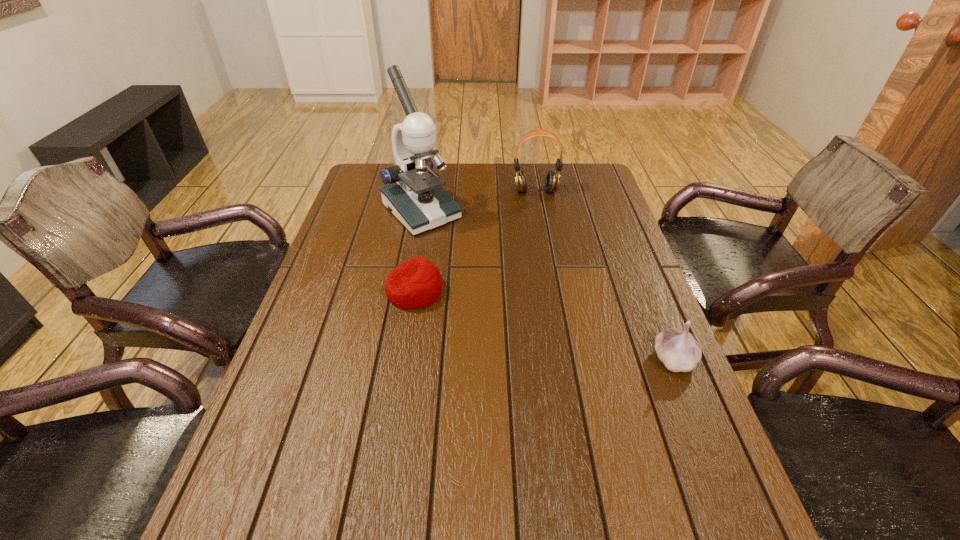
The height and width of the screenshot is (540, 960). Identify the location of vacant point located at the eyepiece of the tallest object. (491, 279).

At what (x,y) coordinates should I click in order to perform the action: click on vacant space located 0.110m at the eyepiece of the tallest object. Please return your answer as a coordinate pair (x, y). Looking at the image, I should click on (461, 251).

Locate an element on the screen. This screenshot has height=540, width=960. vacant space located 0.350m on the ear cups of the headset is located at coordinates (548, 261).

The height and width of the screenshot is (540, 960). I want to click on free location located 0.150m on the ear cups of the headset, so click(x=540, y=221).

You are a GUI agent. You are given a task and a screenshot of the screen. Output one action in this format:
    pyautogui.click(x=<x>, y=<y>)
    Task: Click on the free point located on the ear cups of the headset
    
    Given the screenshot: What is the action you would take?
    pyautogui.click(x=540, y=221)

Where is `microscope present at the far edge`? This screenshot has width=960, height=540. microscope present at the far edge is located at coordinates (415, 196).

Find the location of a particular element. This screenshot has height=540, width=960. headset located in the far edge section of the desktop is located at coordinates [552, 180].

I want to click on object at the left edge, so click(x=415, y=196).

Locate an element on the screen. object that is positioned at the right edge is located at coordinates (678, 350).

Where is `object located at the far left corner`? Image resolution: width=960 pixels, height=540 pixels. object located at the far left corner is located at coordinates (415, 196).